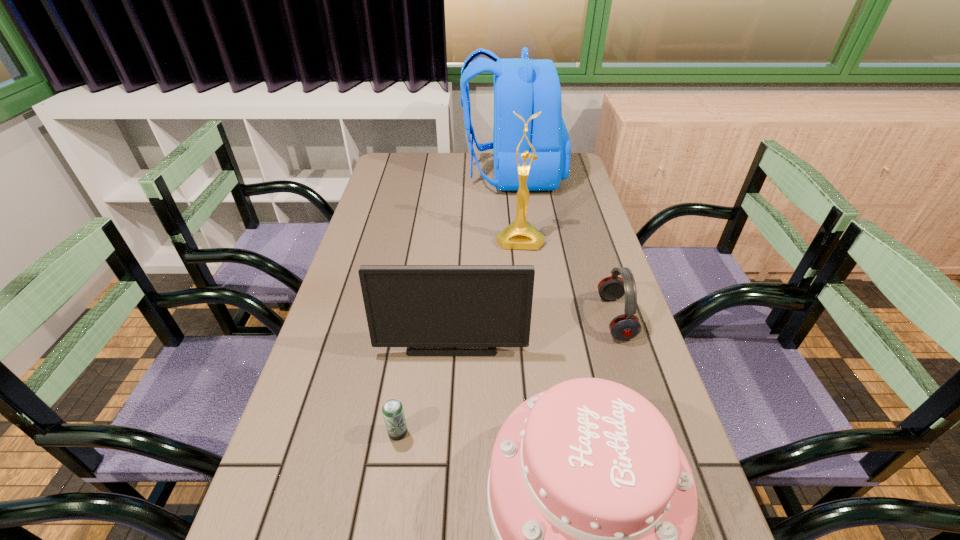
In order to click on the farthest object in this screenshot , I will do `click(526, 86)`.

In order to click on award in this screenshot , I will do `click(520, 234)`.

This screenshot has width=960, height=540. Identify the location of computer monitor. (410, 306).

This screenshot has height=540, width=960. I want to click on earphone, so click(627, 326).

Image resolution: width=960 pixels, height=540 pixels. Identify the location of beer can. pyautogui.click(x=393, y=413).

The width and height of the screenshot is (960, 540). In order to click on vacant space located 0.070m on the back of the backpack in this screenshot , I will do `click(445, 175)`.

Image resolution: width=960 pixels, height=540 pixels. In order to click on vacant space situated on the back of the backpack in this screenshot , I will do `click(445, 175)`.

What are the coordinates of `free location located 0.130m on the back of the backpack` in the screenshot? It's located at (430, 175).

This screenshot has width=960, height=540. I want to click on vacant region located on the front-facing side of the award, so click(x=524, y=277).

Where is `free spot located 0.230m on the screen side of the computer monitor`? free spot located 0.230m on the screen side of the computer monitor is located at coordinates (445, 451).